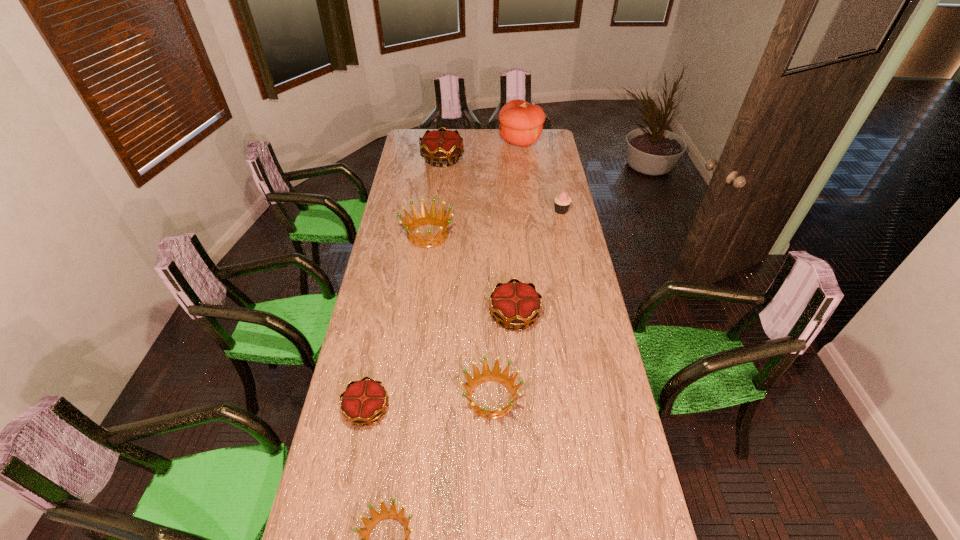
The height and width of the screenshot is (540, 960). In order to click on free space between the biggest gold crown and the rightmost golden crown in this screenshot , I will do `click(467, 278)`.

This screenshot has height=540, width=960. I want to click on unoccupied position between the farthest crown and the fifth nearest object, so click(435, 197).

Locate an element on the screen. The width and height of the screenshot is (960, 540). vacant space in between the pumpkin and the fourth nearest crown is located at coordinates (517, 228).

This screenshot has height=540, width=960. I want to click on vacant point located between the rightmost gold crown and the farthest gold crown, so click(478, 237).

Find the location of a particular element. This screenshot has width=960, height=540. vacant region between the second smallest golden crown and the pumpkin is located at coordinates (506, 269).

Locate an element on the screen. free space between the pumpkin and the rightmost golden crown is located at coordinates (506, 269).

The height and width of the screenshot is (540, 960). In order to click on vacant area that lies between the smallest gold crown and the second biggest gold crown in this screenshot , I will do `click(441, 362)`.

Select which object appears as the third closest to the third farthest crown. Please provide its 2D coordinates. Your answer should be formatted as a tuple, i.e. [(x, y)], where the tuple contains the x and y coordinates of a point satisfying the conditions above.

[(364, 401)]

Find the location of a particular element. Image resolution: width=960 pixels, height=540 pixels. object identified as the seventh closest to the nearest object is located at coordinates (521, 123).

Locate an element on the screen. crown that stands as the closest to the second farthest golden crown is located at coordinates 517,304.